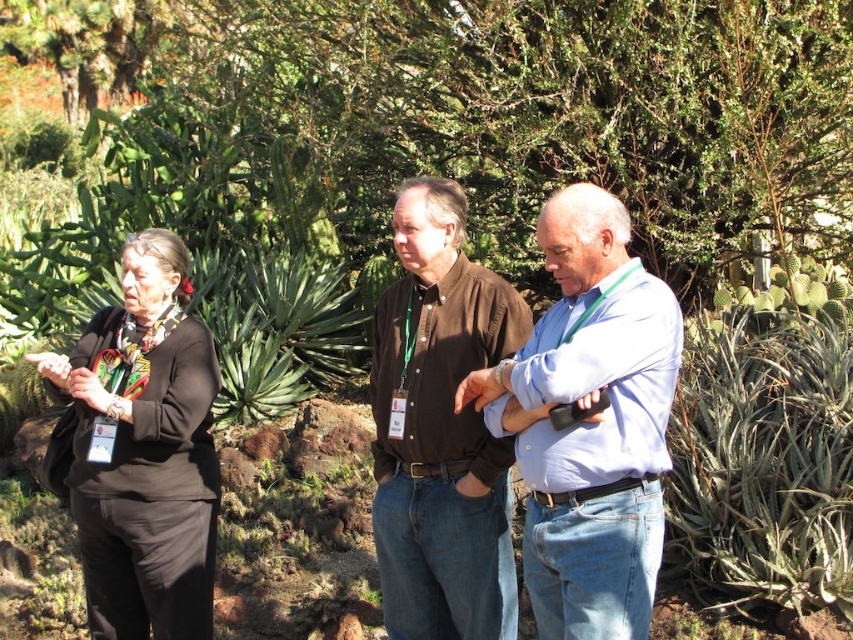
Does brown cotton shirt at center lie behind black fabric at left?

No, it is not.

Does brown cotton shirt at center have a greater width compared to black fabric at left?

No.

Is point (409, 353) closer to viewer compared to point (114, 324)?

Yes, it is.

The width and height of the screenshot is (853, 640). I want to click on brown cotton shirt at center, so click(440, 429).

Between light blue shirt at center and green spiky plant at right, which one is positioned lower?

light blue shirt at center

Does point (495, 419) come closer to viewer compared to point (740, 417)?

Yes, point (495, 419) is in front of point (740, 417).

Where is `light blue shirt at center`? This screenshot has height=640, width=853. light blue shirt at center is located at coordinates (589, 422).

Between light blue shirt at center and black fabric at left, which one is positioned higher?

Positioned higher is light blue shirt at center.

Does light blue shirt at center have a lesser width compared to black fabric at left?

No.

What do you see at coordinates (589, 422) in the screenshot? I see `light blue shirt at center` at bounding box center [589, 422].

I want to click on light blue shirt at center, so click(589, 422).